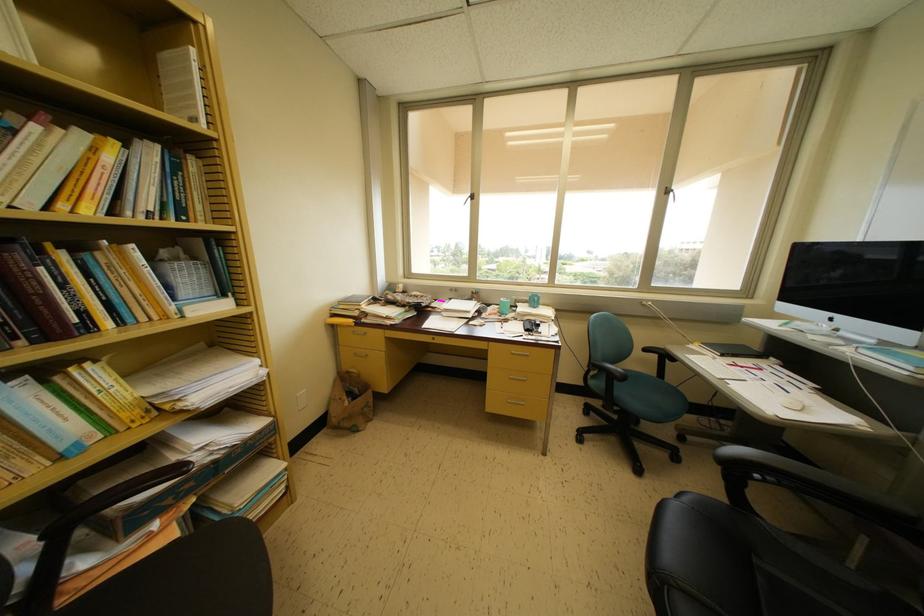
Describe the element at coordinates (361, 331) in the screenshot. I see `a desk drawer handle` at that location.